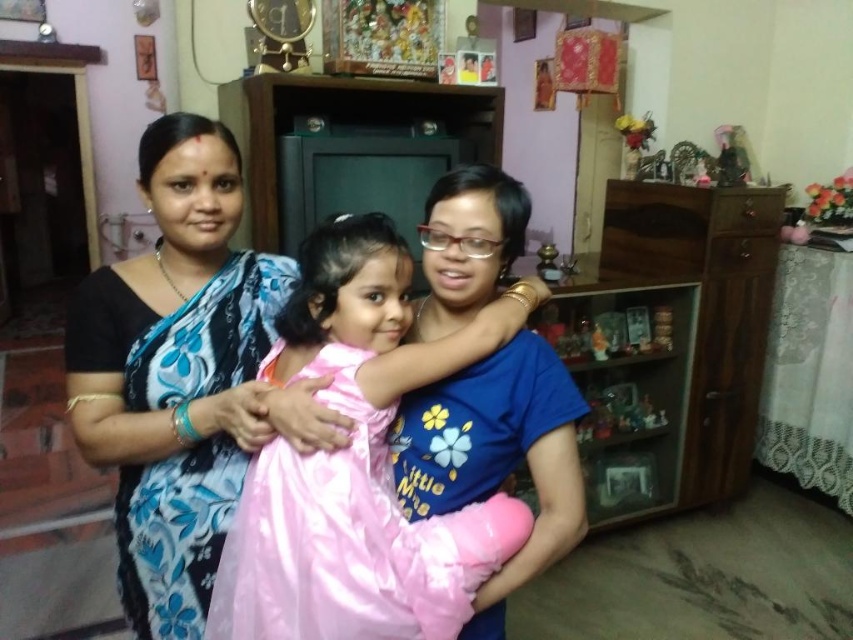
Question: Which of the following is the farthest from the observer?

Choices:
 (A) (195, 161)
 (B) (390, 394)

Answer: (A)

Question: Does pink satin dress at center have a larger size compared to blue floral saree at center?

Choices:
 (A) yes
 (B) no

Answer: (B)

Question: Does pink satin dress at center lie in front of blue floral saree at center?

Choices:
 (A) yes
 (B) no

Answer: (A)

Question: Which of the following is the farthest from the observer?

Choices:
 (A) pink satin dress at center
 (B) blue floral saree at center

Answer: (B)

Question: Does pink satin dress at center come behind blue floral saree at center?

Choices:
 (A) no
 (B) yes

Answer: (A)